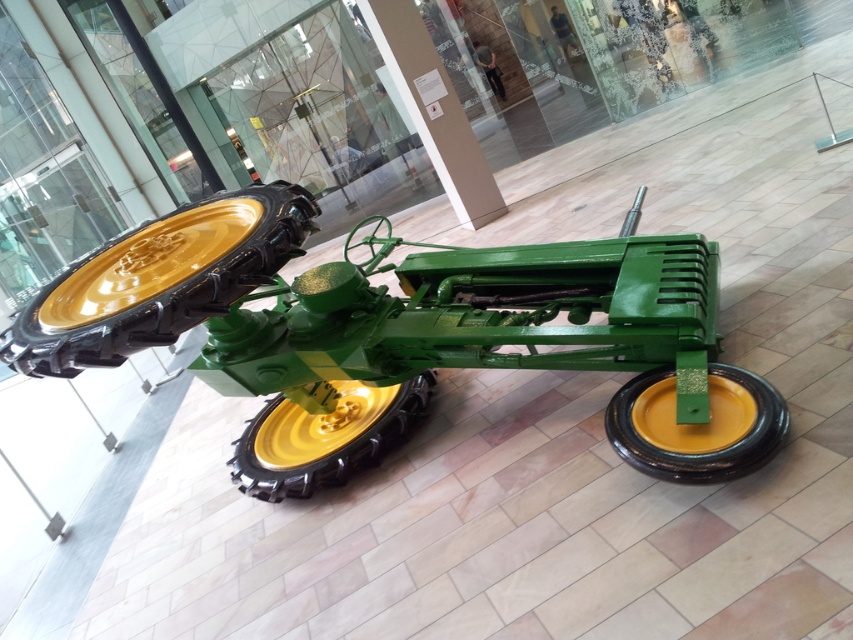
You are a museum guide explaining the layout of the tractor to a visitor. Pointing to the green matte tractor at center and the yellow rubber wheel at center, you want to clarify their positions. Which object is closer to the visitor standing in front of the display?

The green matte tractor at center is closer to the visitor because it is in front of the yellow rubber wheel at center.

You are an engineer assessing the indoor space for maintenance. The ceiling height is exactly the same as the height of the green matte tractor at center. Can you safely drive the yellow rubber wheel at center through the doorway without hitting the ceiling?

The green matte tractor at center is taller than the yellow rubber wheel at center. Since the ceiling height matches the tractor, the yellow rubber wheel at center is shorter and can pass safely under the ceiling.

You are standing at the entrance of the museum and see two points marked in the image. Which point is closer to you, point [48,339] or point [399,412]?

Point [48,339] is in front of point [399,412], so it is closer to you.